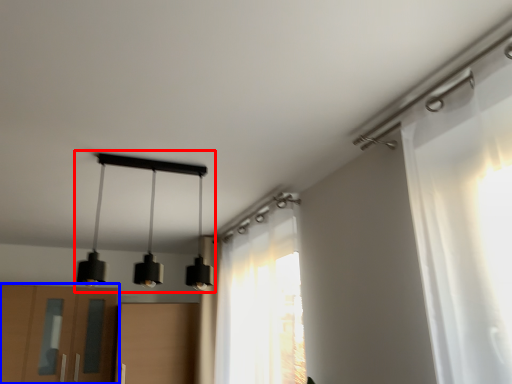
Question: Which of the following is the farthest to the observer, lamp (highlighted by a red box) or cabinetry (highlighted by a blue box)?

Choices:
 (A) lamp
 (B) cabinetry

Answer: (B)